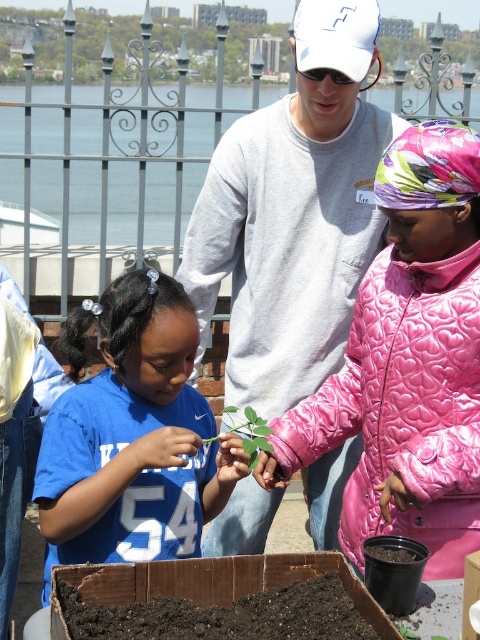
You are a photographer trying to capture a clear shot of both the pink quilted jacket at center and the green matte leafy plant at center. Which object should you focus on first if you want to ensure both are in focus without adjusting your camera settings?

The pink quilted jacket at center is taller than the green matte leafy plant at center. To ensure both are in focus, you should focus on the pink quilted jacket at center first, as it is larger and requires more precise focus.

You are organizing an outdoor event and need to ensure that all participants can see the demonstration area clearly. Given the presence of the blue jersey at center and the green matte leafy plant at center, which object might obstruct the view more if placed in front of the demonstration area?

The blue jersey at center has a larger size compared to the green matte leafy plant at center, so it would obstruct the view more if placed in front of the demonstration area.